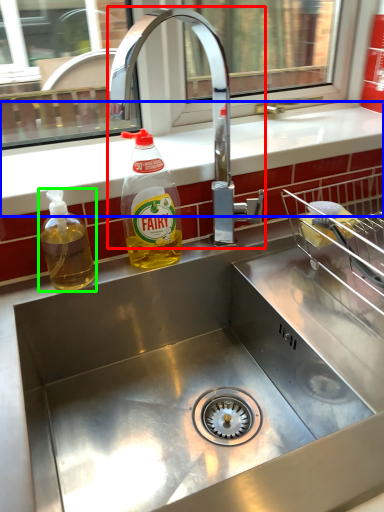
Question: Estimate the real-world distances between objects in this image. Which object is closer to tap (highlighted by a red box), counter top (highlighted by a blue box) or bottle (highlighted by a green box)?

Choices:
 (A) counter top
 (B) bottle

Answer: (A)